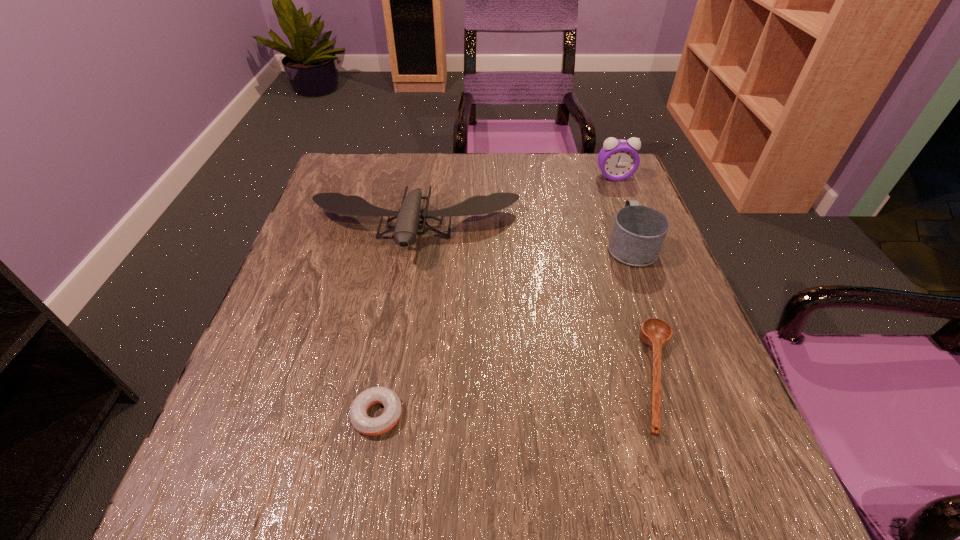
Identify the location of the farthest object. The image size is (960, 540). (618, 160).

Where is `alarm clock`? This screenshot has height=540, width=960. alarm clock is located at coordinates (618, 160).

At what (x,y) coordinates should I click in order to perform the action: click on drone. Please return your answer as a coordinate pair (x, y). The height and width of the screenshot is (540, 960). Looking at the image, I should click on (405, 230).

Where is `mug`? mug is located at coordinates (638, 233).

At what (x,y) coordinates should I click in order to perform the action: click on wooden spoon. Please return your answer as a coordinate pair (x, y). This screenshot has height=540, width=960. Looking at the image, I should click on (654, 332).

I want to click on doughnut, so pyautogui.click(x=361, y=422).

In order to click on blank space located 0.260m on the face of the alarm clock in this screenshot , I will do `click(641, 246)`.

This screenshot has width=960, height=540. In order to click on vacant space situated at the head of the drone in this screenshot , I will do pyautogui.click(x=381, y=427).

Identify the location of free space located 0.250m on the side of the mug with the handle. The height and width of the screenshot is (540, 960). (603, 169).

At what (x,y) coordinates should I click in order to perform the action: click on vacant space located 0.270m on the side of the mug with the handle. Please return your answer as a coordinate pair (x, y). Looking at the image, I should click on (601, 165).